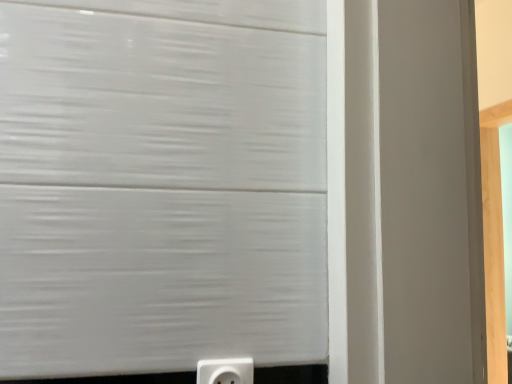
Image resolution: width=512 pixels, height=384 pixels. Identify the location of white plastic socket at lower center. (225, 371).

Describe the element at coordinates (225, 371) in the screenshot. This screenshot has height=384, width=512. I see `white plastic socket at lower center` at that location.

In order to face white plastic socket at lower center, should I rotate leftwards or rightwards?

You should rotate left by 3.608 degrees.

Measure the distance between white plastic socket at lower center and camera.

white plastic socket at lower center is 23.17 inches from camera.

Locate an element on the screen. The height and width of the screenshot is (384, 512). white plastic socket at lower center is located at coordinates (225, 371).